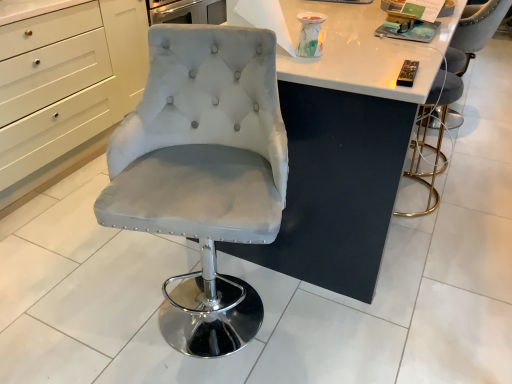
Where is `empty space that is to the right of satin white chair at center, arranged as the 3th chair when viewed from the back`? This screenshot has width=512, height=384. empty space that is to the right of satin white chair at center, arranged as the 3th chair when viewed from the back is located at coordinates (335, 327).